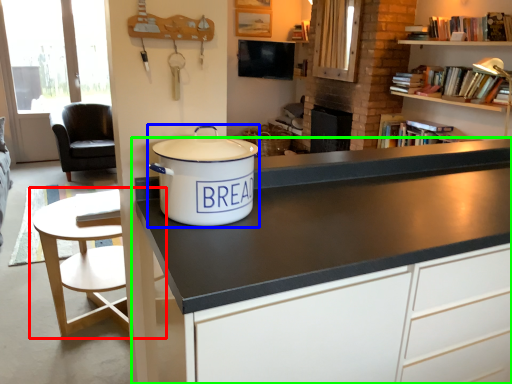
Question: Which is farther away from table (highlighted by a red box)? cooker (highlighted by a blue box) or cabinetry (highlighted by a green box)?

Choices:
 (A) cooker
 (B) cabinetry

Answer: (B)